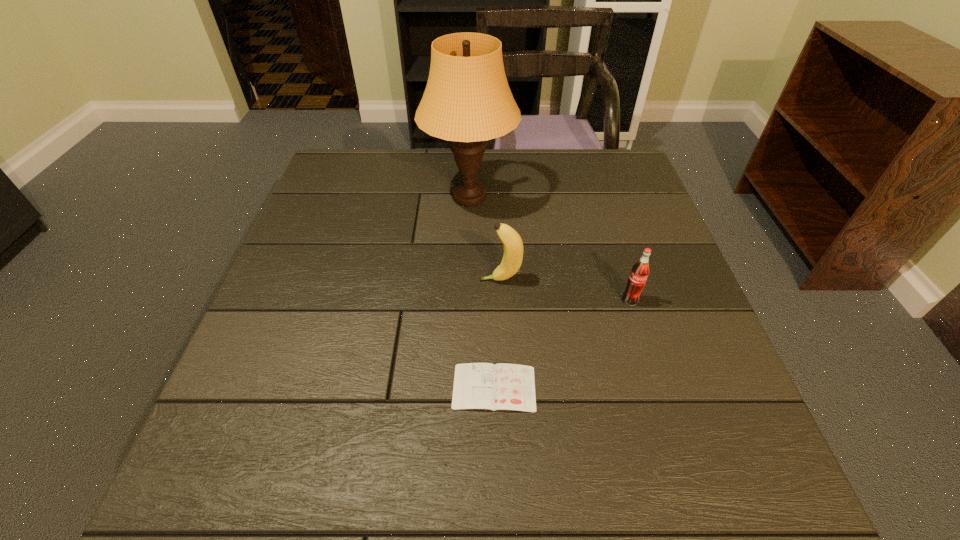
Where is `vacant space located 0.360m from the stem of the third nearest object`? vacant space located 0.360m from the stem of the third nearest object is located at coordinates (321, 280).

Identify the location of vacant space located on the label of the second nearest object. point(640,333).

What are the coordinates of `free space located 0.260m on the right of the nearest object` in the screenshot? It's located at (678, 388).

You are a GUI agent. You are given a task and a screenshot of the screen. Output one action in this format:
    pyautogui.click(x=<x>, y=<y>)
    Task: Click on the object present at the far edge
    The width and height of the screenshot is (960, 540).
    Given the screenshot: What is the action you would take?
    (467, 100)

Locate an element on the screen. Image resolution: width=960 pixels, height=540 pixels. object that is at the right edge is located at coordinates (640, 271).

Where is `vacant space at the left edge of the desktop`? vacant space at the left edge of the desktop is located at coordinates (313, 282).

Find the location of a particular element. Image resolution: width=960 pixels, height=540 pixels. vacant space at the right edge is located at coordinates (660, 401).

I want to click on vacant area at the far left corner of the desktop, so click(333, 161).

The height and width of the screenshot is (540, 960). In the image, there is a desktop. Identify the location of vacant space at the far right corner. (620, 173).

Locate an element on the screen. vacant space at the near right corner of the desktop is located at coordinates (695, 462).